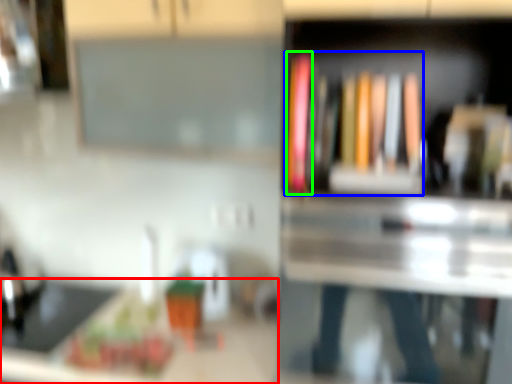
Question: Which object is positioned farthest from counter top (highlighted by a red box)? Select from book (highlighted by a blue box) and book (highlighted by a green box).

Choices:
 (A) book
 (B) book

Answer: (B)